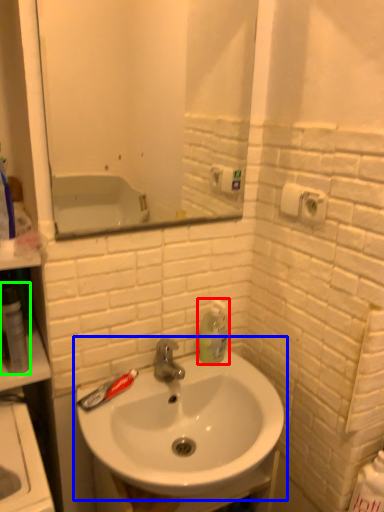
Question: Which object is positioned closest to soap dispenser (highlighted by a red box)? Select from sink (highlighted by a blue box) and mouthwash (highlighted by a green box).

Choices:
 (A) sink
 (B) mouthwash

Answer: (A)